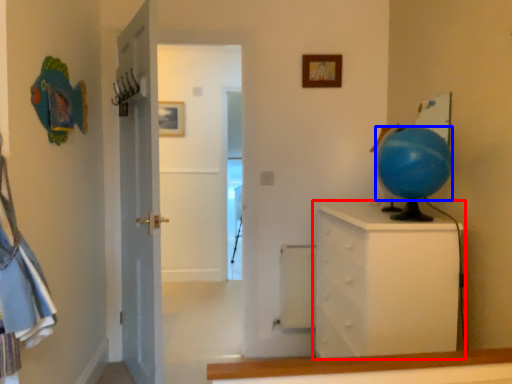
Question: Among these objects, which one is farthest to the camera, chest of drawers (highlighted by a red box) or balloon (highlighted by a blue box)?

Choices:
 (A) chest of drawers
 (B) balloon

Answer: (A)